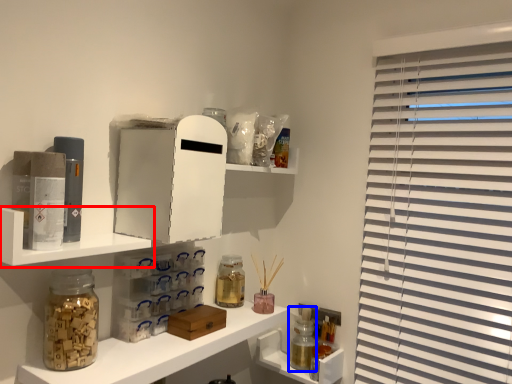
Question: Which object appears closest to the camera in this image, shelf (highlighted by a red box) or bottle (highlighted by a blue box)?

Choices:
 (A) shelf
 (B) bottle

Answer: (A)